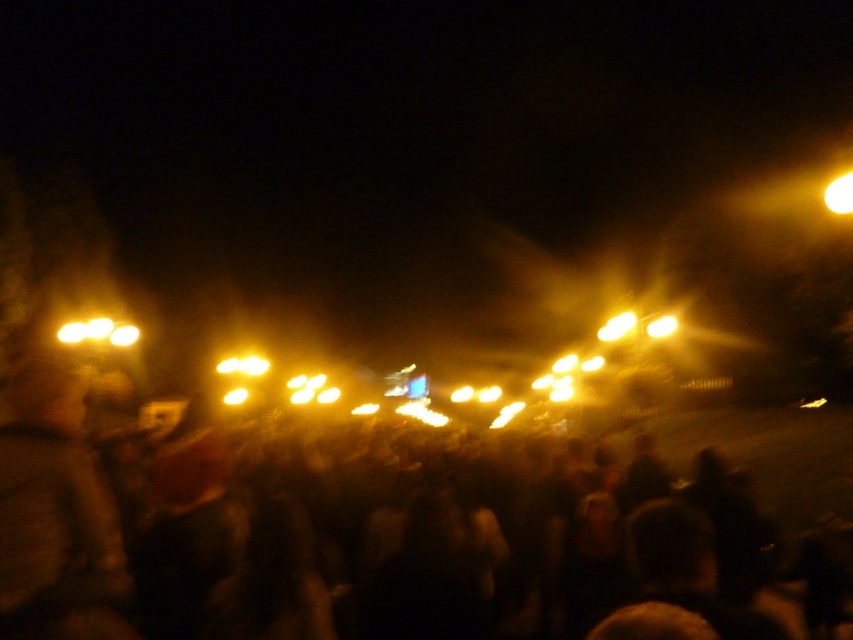
You are at a nighttime event and notice two light sources. One is the matte yellow lights at left and the other is the matte yellow light at upper right. Which of these two lights appears wider?

The matte yellow light at upper right appears wider than the matte yellow lights at left.

You are at a concert and want to find the nearest exit. You notice two sources of light in the distance. One is the matte yellow lights at left and the other is the matte yellow light at upper right. Which light is closer to the ground?

The matte yellow lights at left is positioned under the matte yellow light at upper right, meaning it is closer to the ground.